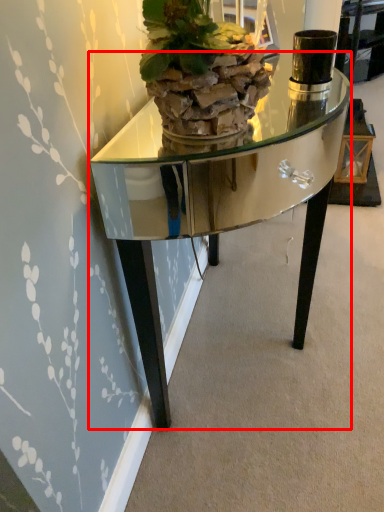
Question: Where is table (annotated by the red box) located in relation to houseplant in the image?

Choices:
 (A) left
 (B) right

Answer: (B)